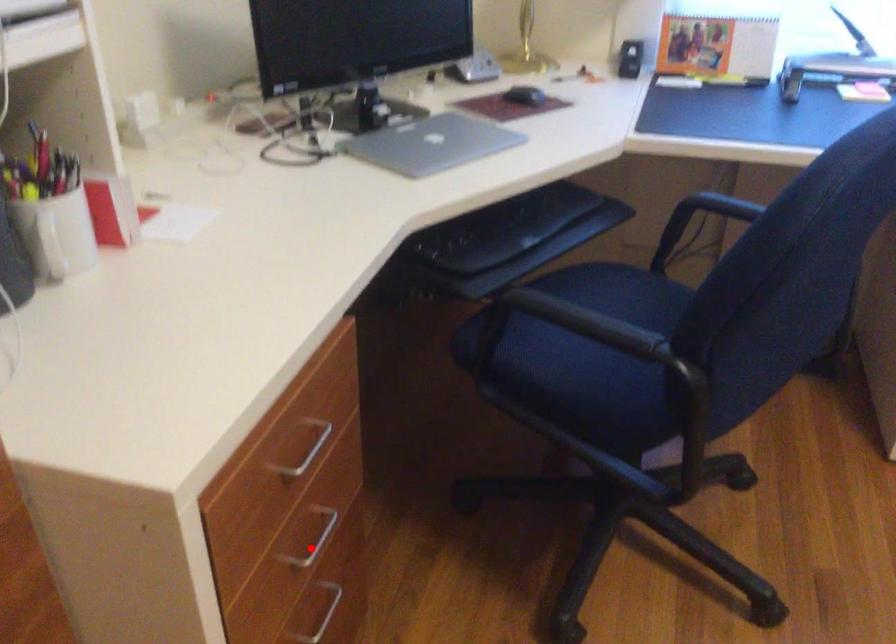
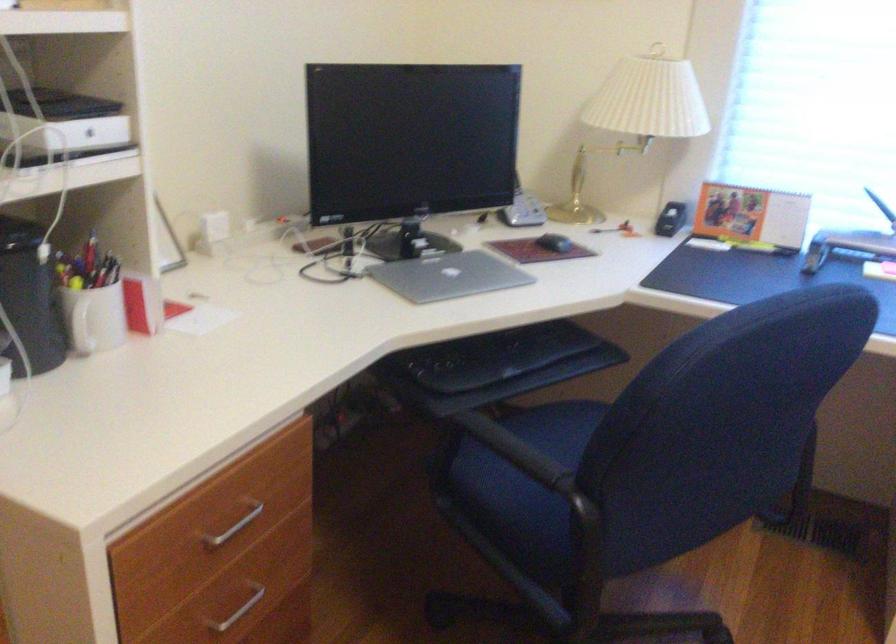
Question: I am providing you with two images of the same scene from different viewpoints. Given a red point in image1, look at the same physical point in image2. Is it:

Choices:
 (A) Closer to the viewpoint
 (B) Farther from the viewpoint

Answer: (B)